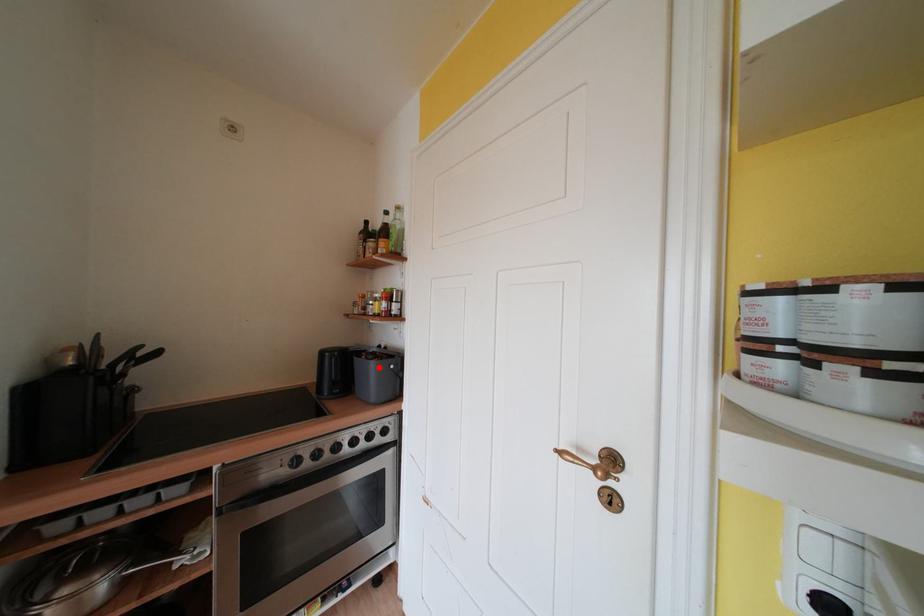
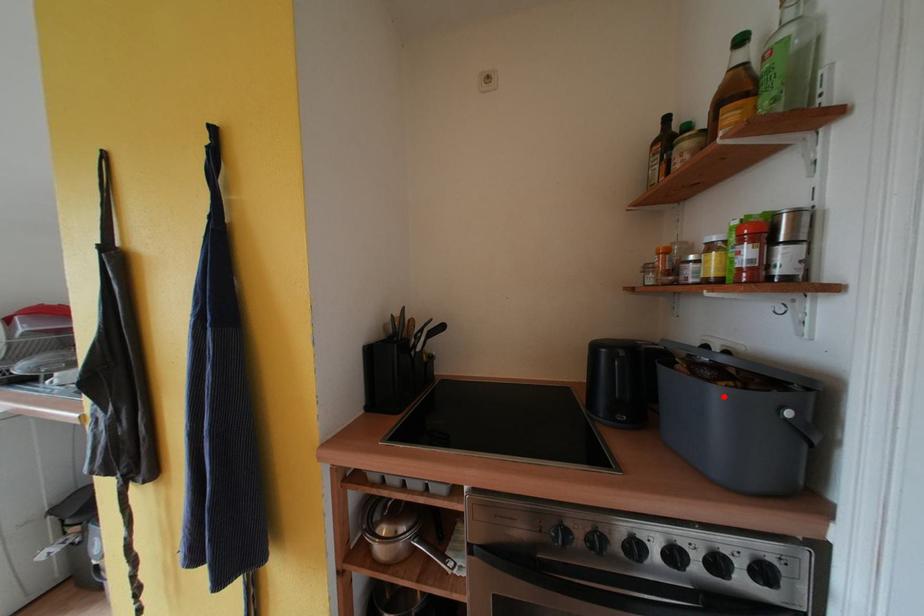
I am providing you with two images of the same scene from different viewpoints. A red point is marked on the first image and another point is marked on the second image. Do the highlighted points in image1 and image2 indicate the same real-world spot?

Yes